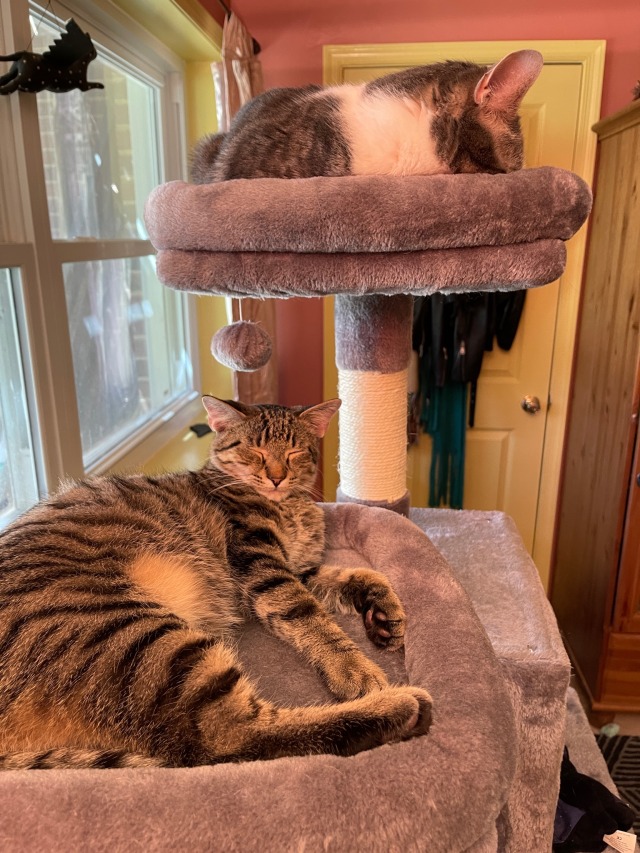
You are a GUI agent. You are given a task and a screenshot of the screen. Output one action in this format:
    pyautogui.click(x=<x>, y=<y>)
    Task: Click on the cat tower
    This screenshot has width=640, height=853.
    Given the screenshot: What is the action you would take?
    pyautogui.click(x=524, y=653)